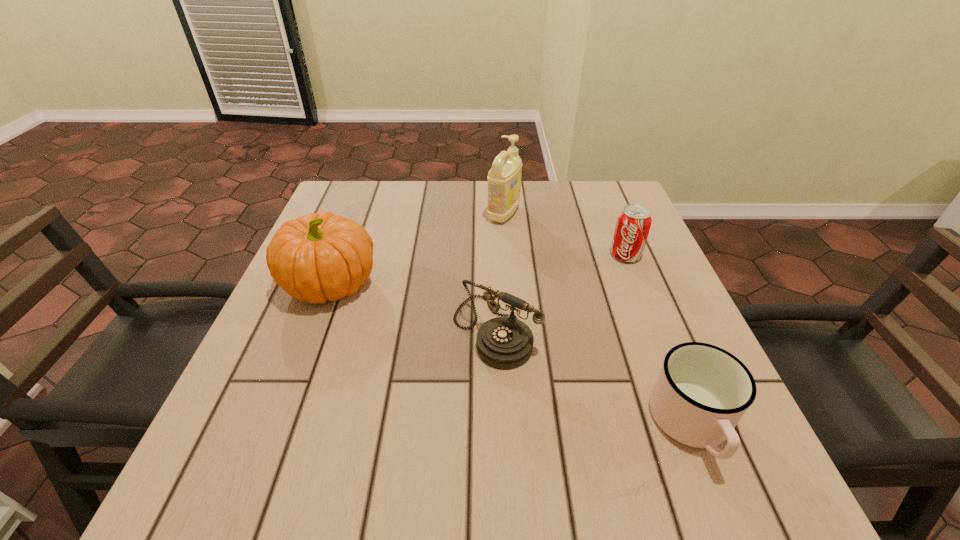
You are a GUI agent. You are given a task and a screenshot of the screen. Output one action in this format:
    pyautogui.click(x=<x>, y=<y>)
    Task: Click on the detergent
    Image resolution: width=960 pixels, height=540 pixels.
    Given the screenshot: What is the action you would take?
    pyautogui.click(x=504, y=178)

I want to click on pumpkin, so [x=318, y=257].

Where is `soda`? soda is located at coordinates pyautogui.click(x=633, y=225).

Identify the location of telephone. The height and width of the screenshot is (540, 960). (505, 343).

The height and width of the screenshot is (540, 960). I want to click on mug, so click(702, 391).

Identify the location of free space located on the left of the detergent. This screenshot has height=540, width=960. pyautogui.click(x=340, y=214).

The width and height of the screenshot is (960, 540). In order to click on vacant space located on the surface of the pumpkin in this screenshot , I will do `click(429, 284)`.

This screenshot has width=960, height=540. I want to click on free point located on the left of the soda, so point(466,255).

This screenshot has width=960, height=540. Identify the location of vacant space situated 0.220m on the left of the telephone. (340, 330).

In order to click on object that is at the far edge in this screenshot , I will do `click(504, 178)`.